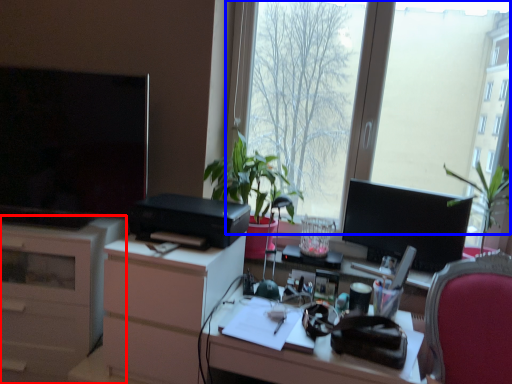
Question: Among these objects, which one is nearest to the camera, cabinetry (highlighted by a red box) or window (highlighted by a blue box)?

Choices:
 (A) cabinetry
 (B) window

Answer: (B)